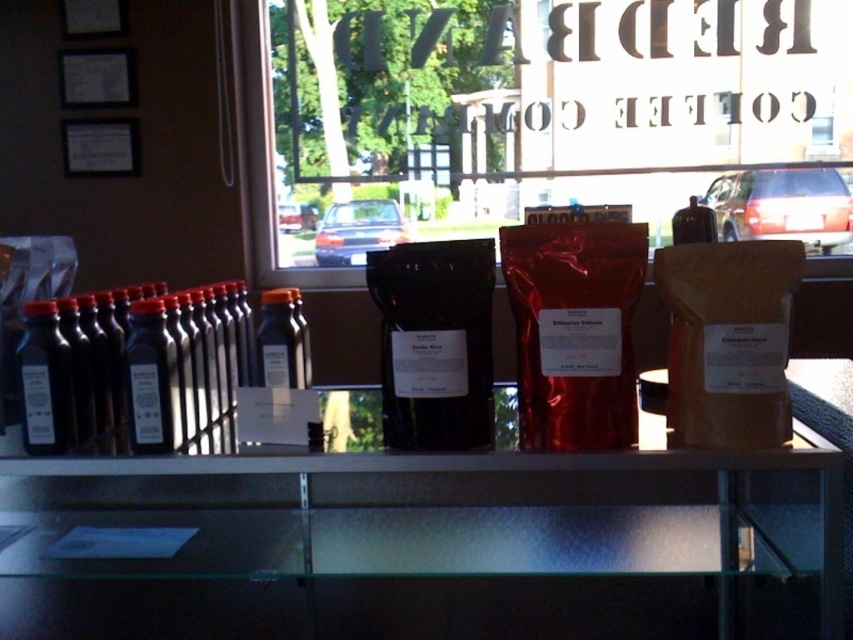
Consider the image. Is transparent glass window at center further to the viewer compared to matte black bottle at left?

Yes.

Can you confirm if transparent glass window at center is positioned to the right of matte black bottle at left?

Yes, transparent glass window at center is to the right of matte black bottle at left.

Is point (579, 177) more distant than point (38, 442)?

Yes.

At what (x,y) coordinates should I click in order to perform the action: click on transparent glass window at center. Please return your answer as a coordinate pair (x, y). Looking at the image, I should click on (554, 122).

Between black matte bottles at left and black glass bottle at left, which one appears on the right side from the viewer's perspective?

black matte bottles at left

Does black matte bottles at left come in front of black glass bottle at left?

Yes.

Locate an element on the screen. The height and width of the screenshot is (640, 853). black matte bottles at left is located at coordinates (144, 380).

Is the position of black matte bottles at left more distant than that of matte black bottle at left?

That is True.

Looking at this image, is black matte bottles at left taller than matte black bottle at left?

Indeed, black matte bottles at left has a greater height compared to matte black bottle at left.

The height and width of the screenshot is (640, 853). Find the location of `black matte bottles at left`. black matte bottles at left is located at coordinates (144, 380).